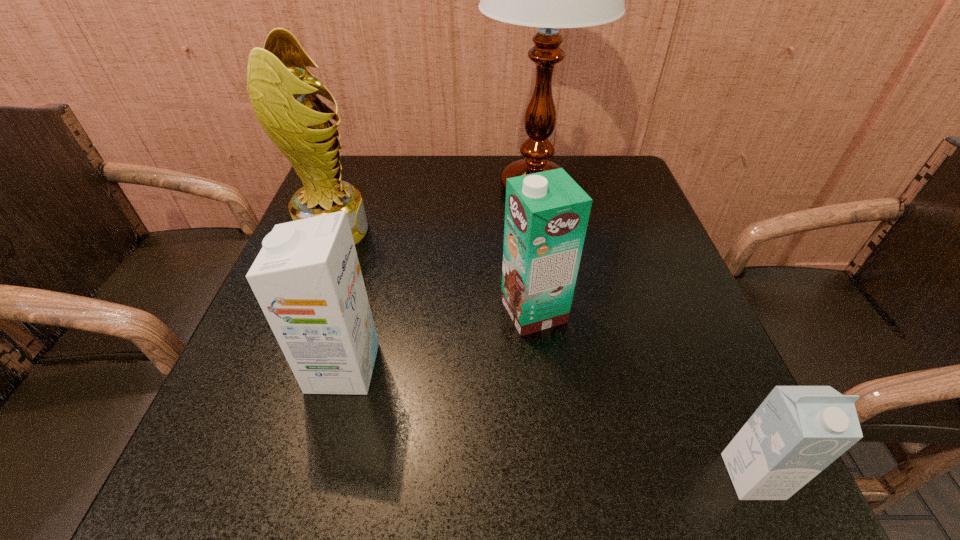
Find the location of a particular element. The image size is (960, 540). free space between the table lamp and the second nearest carton is located at coordinates (439, 278).

Identify the location of empty space between the nearest carton and the award. The width and height of the screenshot is (960, 540). click(543, 354).

Find the location of a particular element. This screenshot has width=960, height=540. vacant area that lies between the second nearest object and the third farthest object is located at coordinates (439, 339).

Where is `free space that is in between the shortest carton and the fourth shortest object`? The height and width of the screenshot is (540, 960). free space that is in between the shortest carton and the fourth shortest object is located at coordinates pos(543,354).

Identify which object is the second nearest to the tallest object. Please provide its 2D coordinates. Your answer should be formatted as a tuple, i.e. [(x, y)], where the tuple contains the x and y coordinates of a point satisfying the conditions above.

[(283, 93)]

Select which object is the second closest to the shortest object. Please provide its 2D coordinates. Your answer should be formatted as a tuple, i.e. [(x, y)], where the tuple contains the x and y coordinates of a point satisfying the conditions above.

[(307, 279)]

The height and width of the screenshot is (540, 960). In order to click on carton that is the second closest to the award in this screenshot , I will do 546,214.

Identify the location of carton object that ranks as the closest to the leftmost carton. This screenshot has width=960, height=540. (546, 214).

Locate an element on the screen. The height and width of the screenshot is (540, 960). free space that satisfies the following two spatial constraints: 1. on the front-facing side of the award; 2. on the back side of the second carton from left to right is located at coordinates (303, 311).